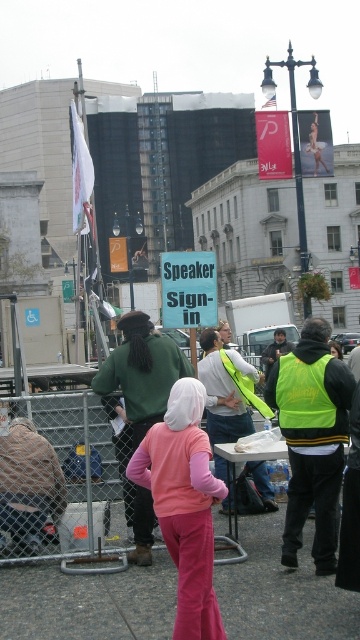
The height and width of the screenshot is (640, 360). Describe the element at coordinates (183, 504) in the screenshot. I see `pink velour pants at center` at that location.

Is pink velour pants at center shorter than neon yellow safety vest at center?

In fact, pink velour pants at center may be taller than neon yellow safety vest at center.

Image resolution: width=360 pixels, height=640 pixels. In order to click on pink velour pants at center in this screenshot , I will do `click(183, 504)`.

Between neon yellow vest at right and neon yellow safety vest at center, which one appears on the left side from the viewer's perspective?

neon yellow safety vest at center is more to the left.

In order to click on neon yellow vest at right in this screenshot , I will do `click(312, 438)`.

The height and width of the screenshot is (640, 360). Find the location of `neon yellow vest at right`. neon yellow vest at right is located at coordinates (312, 438).

Is point (309, 449) positioned before point (167, 442)?

No, (309, 449) is further to viewer.

Can you confirm if neon yellow vest at right is taller than pink velour pants at center?

Correct, neon yellow vest at right is much taller as pink velour pants at center.

The width and height of the screenshot is (360, 640). Describe the element at coordinates (312, 438) in the screenshot. I see `neon yellow vest at right` at that location.

Where is `neon yellow vest at right`? The height and width of the screenshot is (640, 360). neon yellow vest at right is located at coordinates pos(312,438).